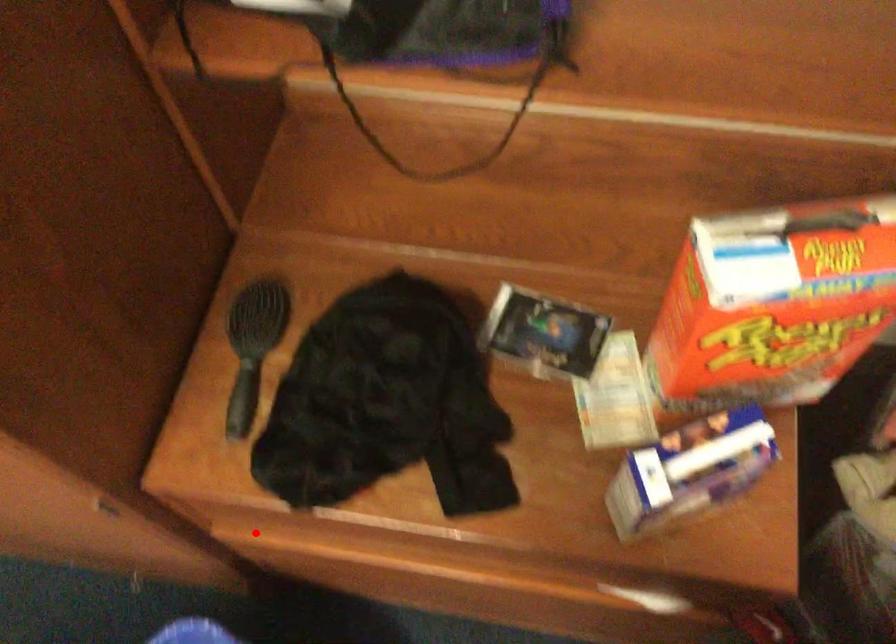
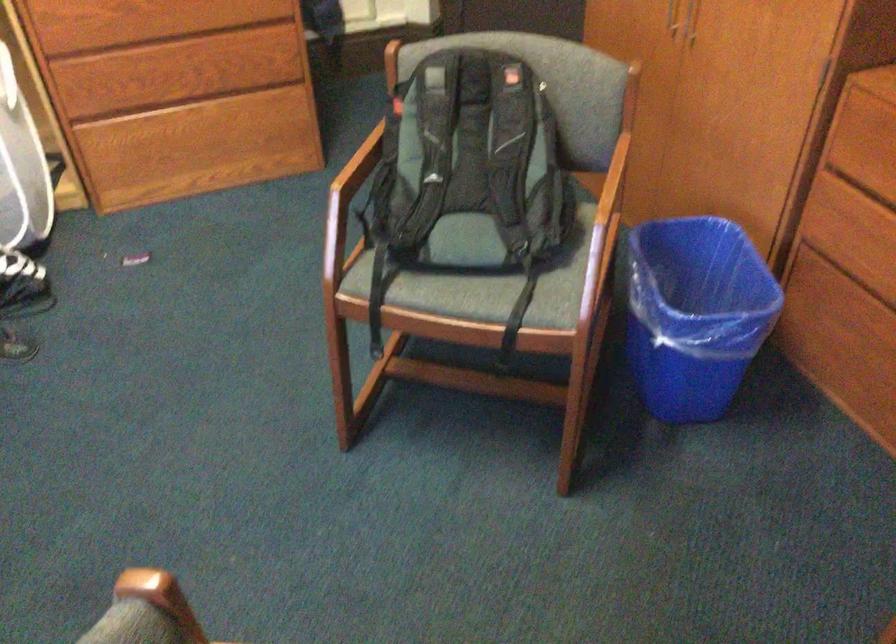
Question: I am providing you with two images of the same scene from different viewpoints. Image1 has a red point marked. In image2, the corresponding 3D location appears at what relative position? Reply with the corresponding letter.

Choices:
 (A) Closer
 (B) Farther

Answer: (B)